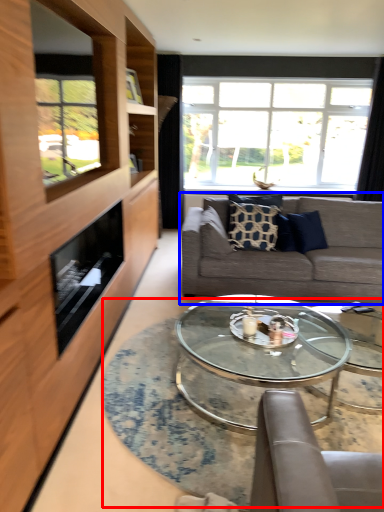
Question: Which object is closer to the camera taking this photo, table (highlighted by a red box) or studio couch (highlighted by a blue box)?

Choices:
 (A) table
 (B) studio couch

Answer: (A)